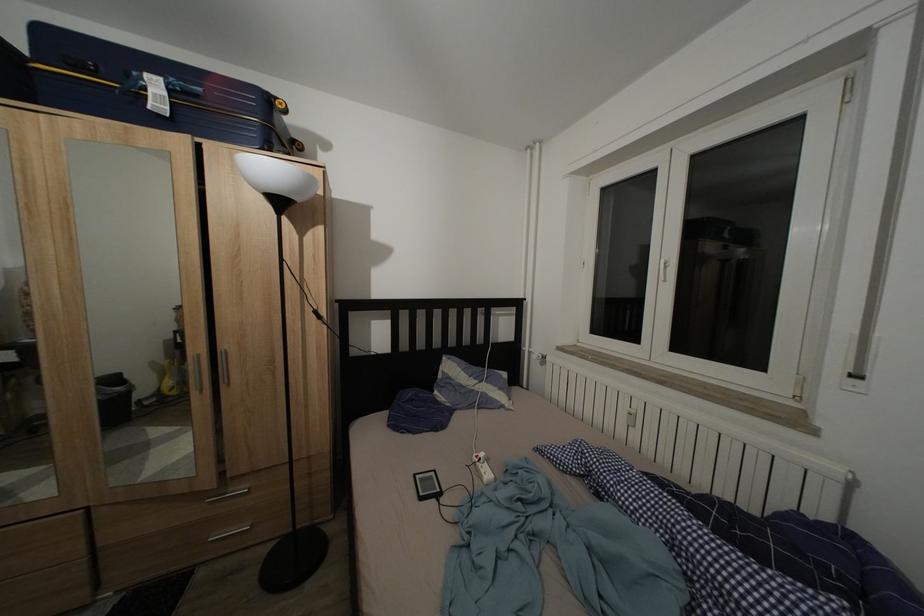
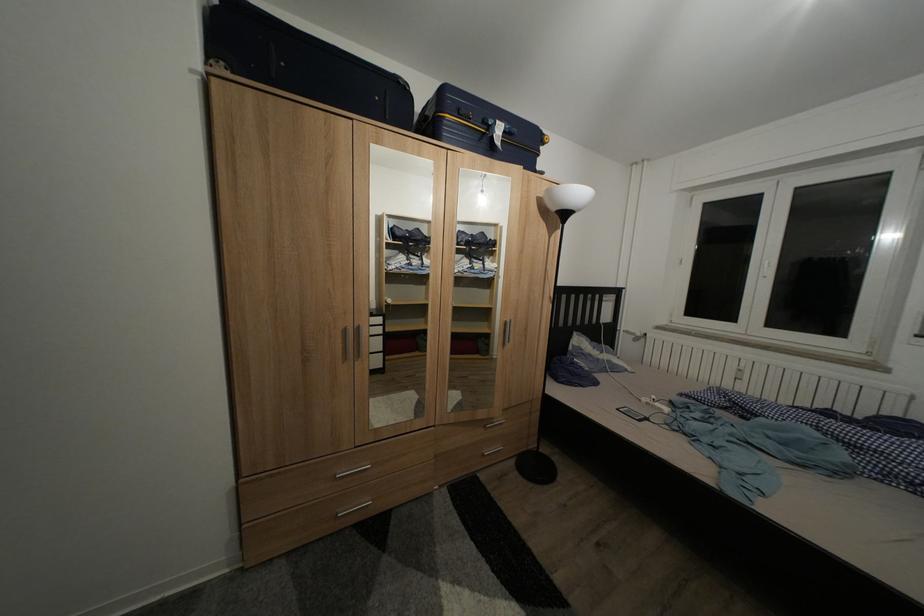
Question: Which direction would the cameraman need to move to produce the second image? Reply with the corresponding letter.

Choices:
 (A) Left
 (B) Right
 (C) Forward
 (D) Backward

Answer: (A)